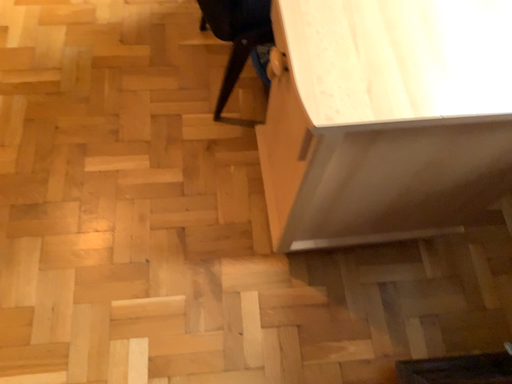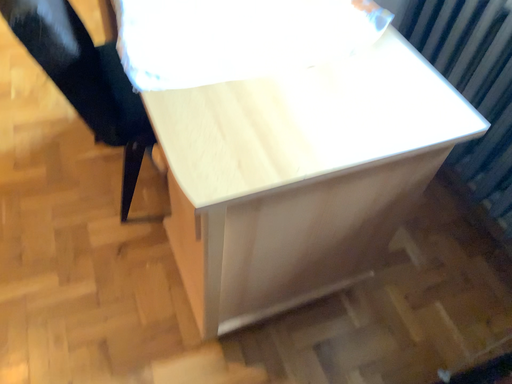
Question: Which way did the camera rotate in the video?

Choices:
 (A) rotated left
 (B) rotated right

Answer: (B)